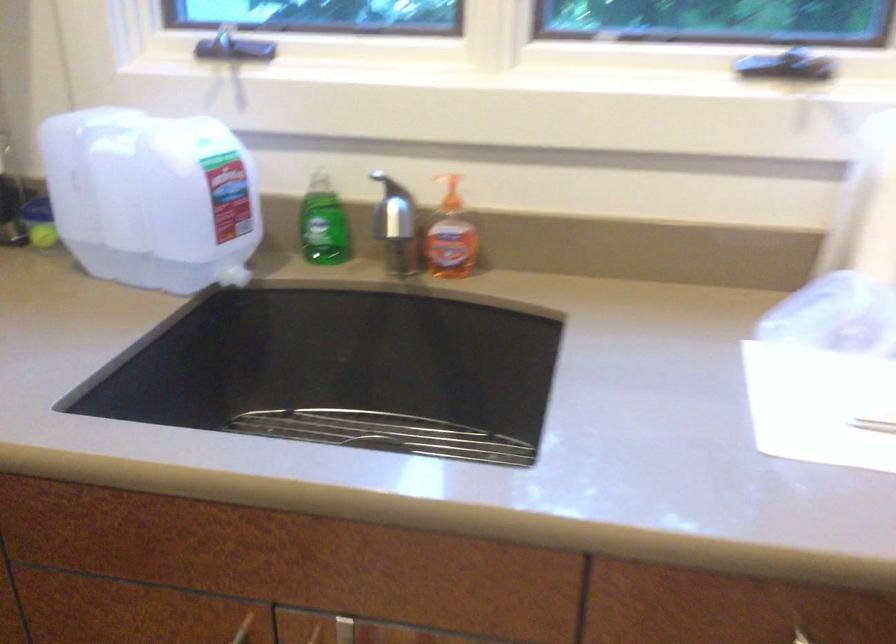
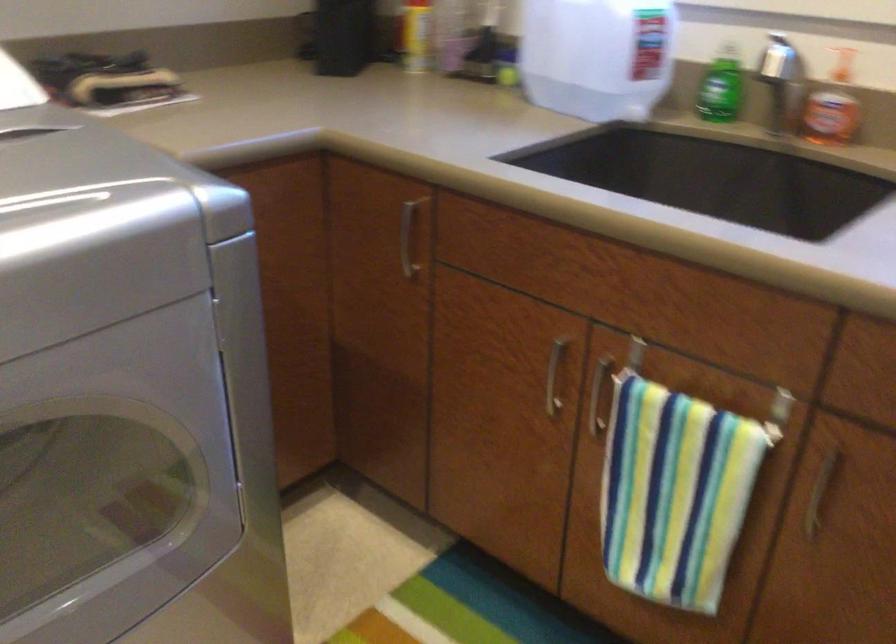
Locate, in the second image, the point that corresponds to (x=170, y=218) in the first image.

(597, 55)